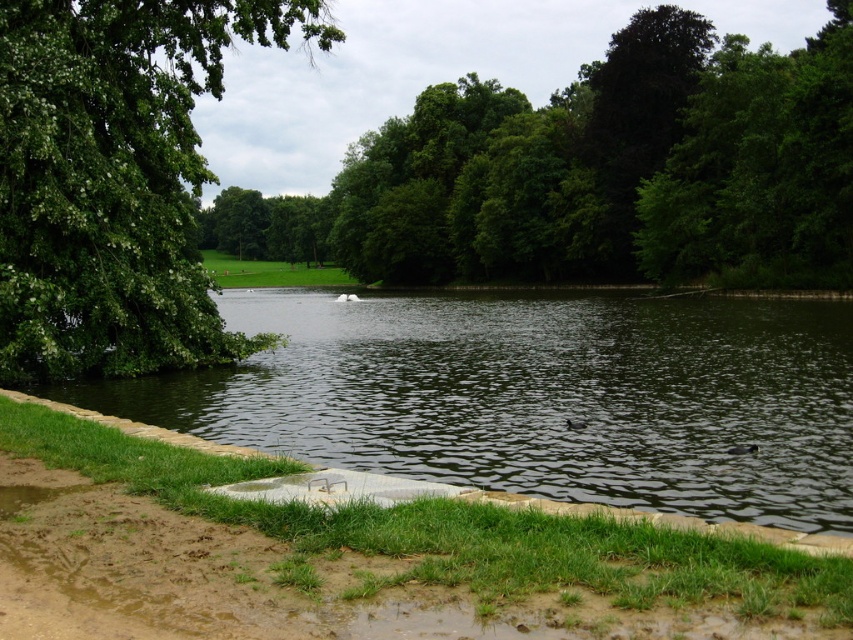
You are standing in the park and want to take a photo of the dark green water at center and the green leafy tree at upper left. Which object will appear closer to the camera in the photo?

The dark green water at center appears closer to the camera in the photo because it is positioned in front of the green leafy tree at upper left.

You are standing in the park and want to know which object occupies more horizontal space in the scene. Based on the dark green water at center and the green leafy tree at upper left, which one has a wider spread?

The dark green water at center has a lesser width compared to green leafy tree at upper left, so the green leafy tree at upper left has a wider spread.

You are planning to take a photo of the dark green water at center and the green leafy tree at upper center. Which object should you focus on first if you want to capture both in a single frame without moving the camera?

You should focus on the green leafy tree at upper center first because it is larger than the dark green water at center, allowing you to frame it properly before adjusting for the smaller area of water.